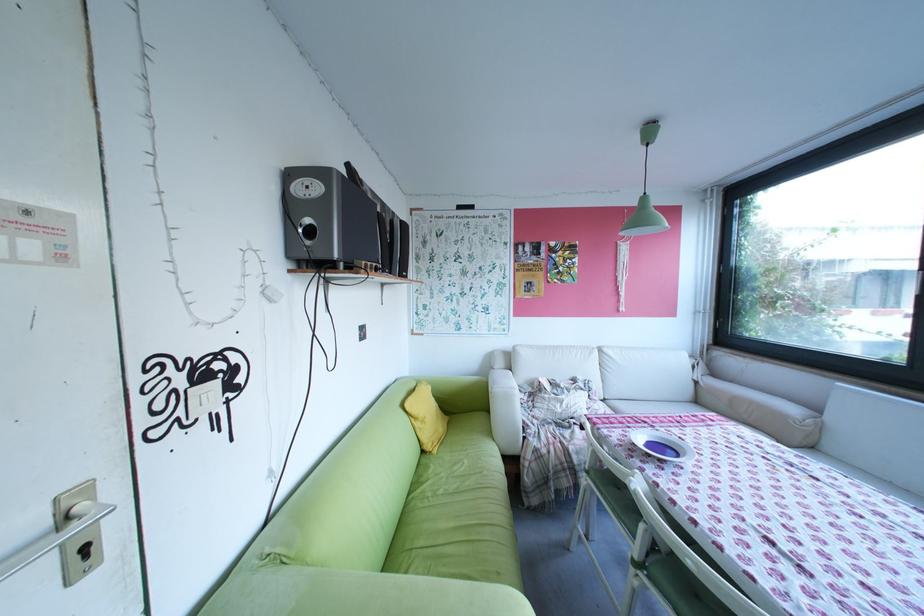
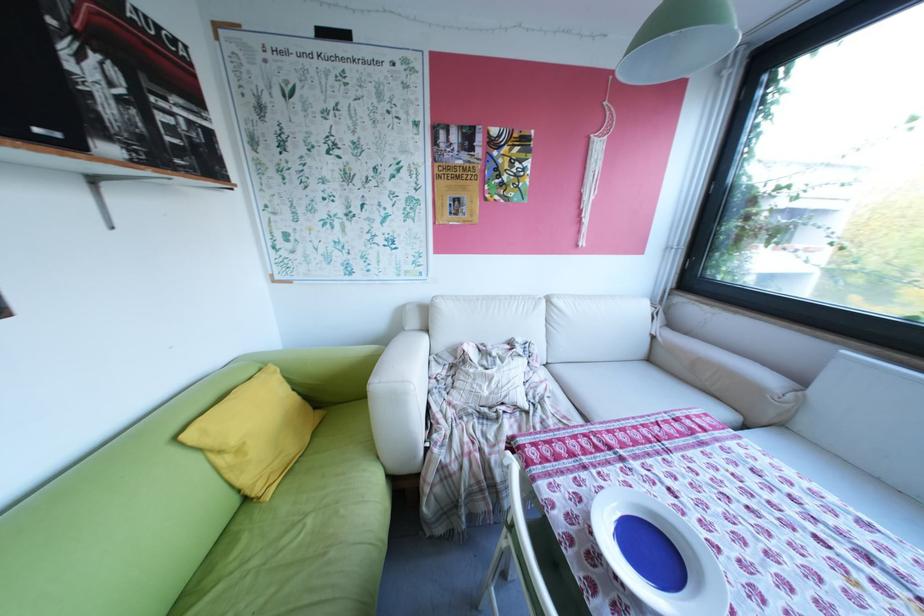
Question: Based on the continuous images, in which direction is the camera rotating? Reply with the corresponding letter.

Choices:
 (A) Left
 (B) Right
 (C) Up
 (D) Down

Answer: (D)